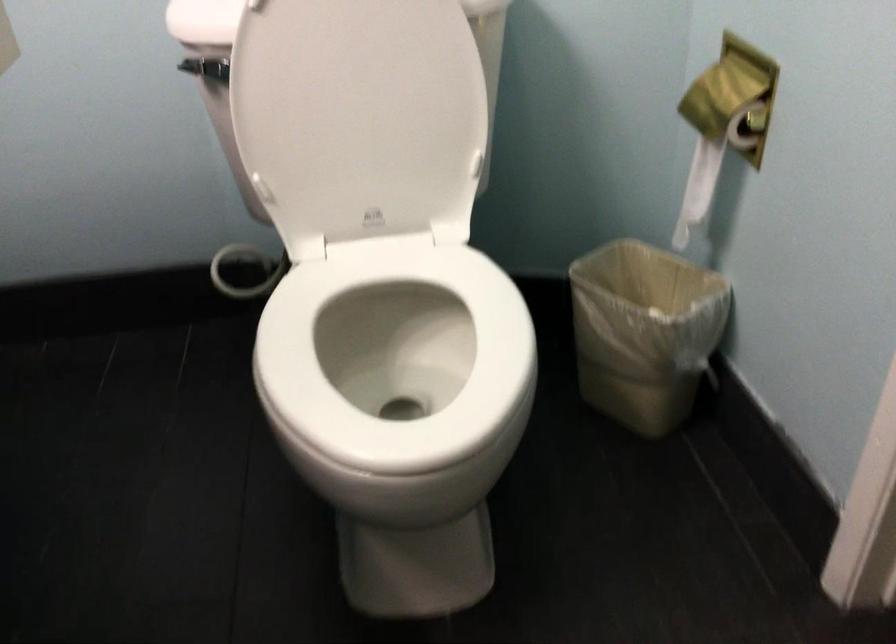
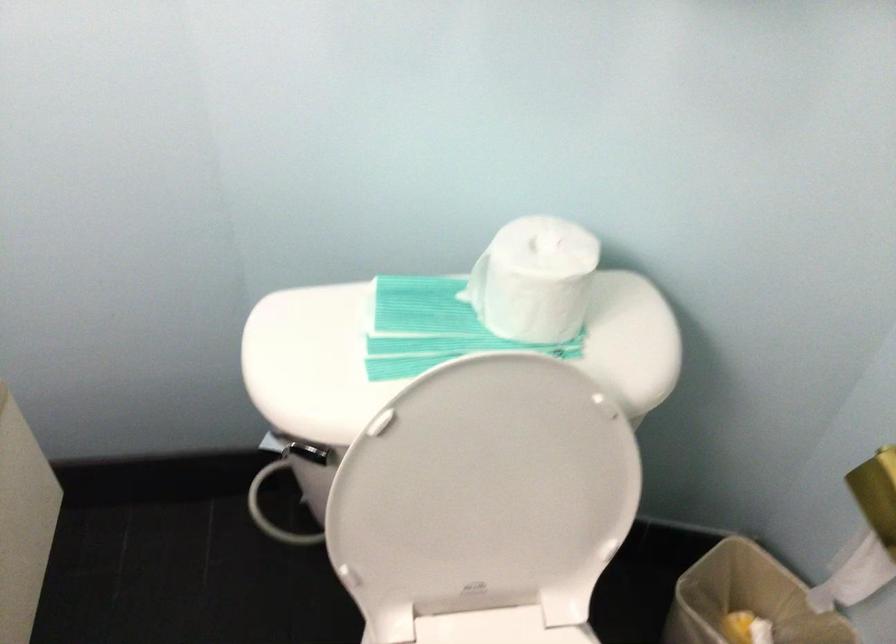
Find the pixel in the second image that matches pixel 356 88 in the first image.

(486, 496)